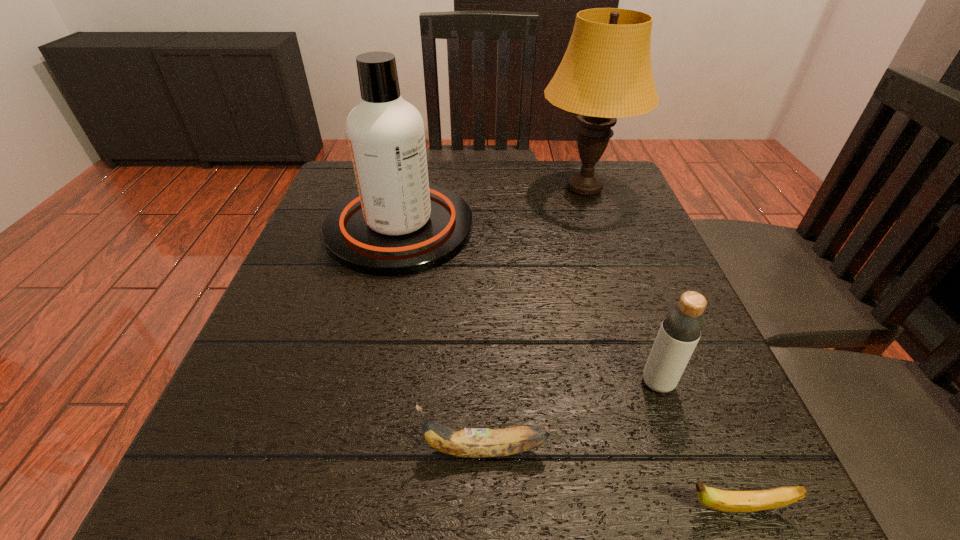
Where is `lampshade at the right edge`? lampshade at the right edge is located at coordinates (606, 73).

The height and width of the screenshot is (540, 960). I want to click on bottle that is at the right edge, so click(683, 324).

What are the coordinates of `banana located at the right edge` in the screenshot? It's located at (720, 500).

Identify the location of object positioned at the far left corner. This screenshot has width=960, height=540. (398, 224).

Find the location of a particular element. This screenshot has height=540, width=960. object that is positioned at the far right corner is located at coordinates (606, 73).

Where is `object at the near right corner`? object at the near right corner is located at coordinates (720, 500).

Locate an element on the screen. The image size is (960, 540). vacant space at the far edge of the desktop is located at coordinates (460, 196).

The width and height of the screenshot is (960, 540). In the image, there is a desktop. Identify the location of vacant space at the near edge. (496, 494).

What are the coordinates of `free space at the left edge` in the screenshot? It's located at (261, 448).

In the image, there is a desktop. Identify the location of vacant region at the right edge. The height and width of the screenshot is (540, 960). (654, 408).